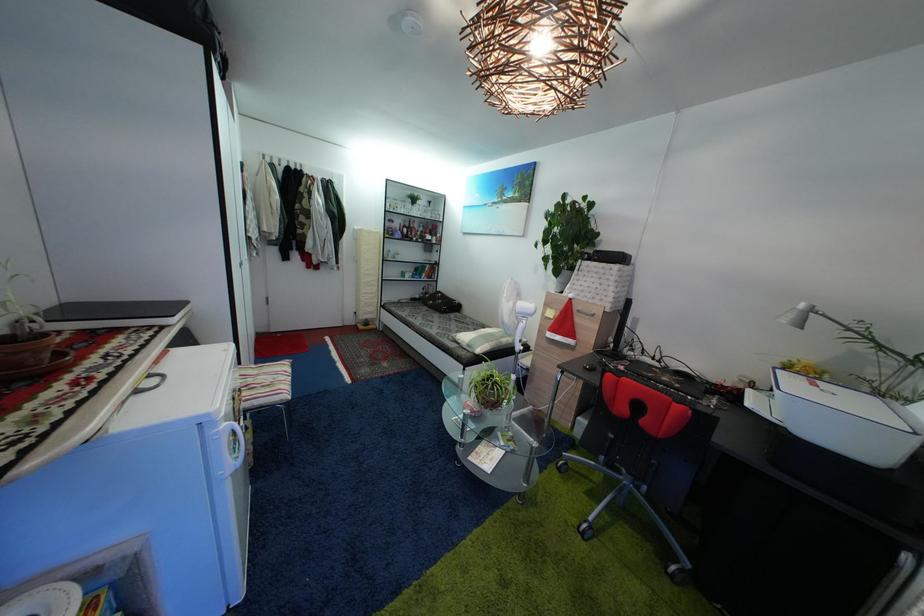
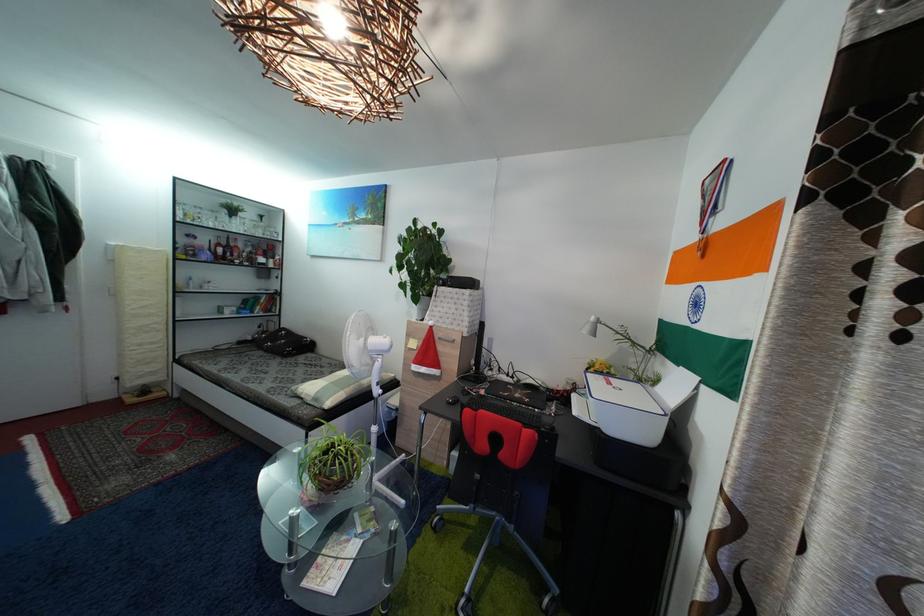
In the second image, find the point that corresponds to the point at 576,294 in the first image.

(435, 321)